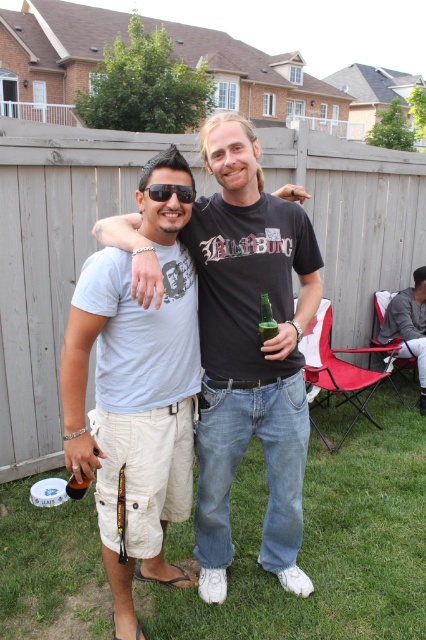
Looking at this image, can you confirm if light beige cargo shorts at center is thinner than green matte bottle at center?

In fact, light beige cargo shorts at center might be wider than green matte bottle at center.

Consider the image. Is light beige cargo shorts at center wider than green matte bottle at center?

Indeed, light beige cargo shorts at center has a greater width compared to green matte bottle at center.

You are a GUI agent. You are given a task and a screenshot of the screen. Output one action in this format:
    pyautogui.click(x=<x>, y=<y>)
    Task: Click on the light beige cargo shorts at center
    
    Given the screenshot: What is the action you would take?
    pyautogui.click(x=135, y=392)

Looking at this image, which is more to the left, matte black t-shirt at center or green matte bottle at center?

From the viewer's perspective, matte black t-shirt at center appears more on the left side.

Can you confirm if matte black t-shirt at center is positioned above green matte bottle at center?

No, matte black t-shirt at center is not above green matte bottle at center.

At what (x,y) coordinates should I click in order to perform the action: click on matte black t-shirt at center. Please return your answer as a coordinate pair (x, y). The height and width of the screenshot is (640, 426). Looking at the image, I should click on (250, 352).

The image size is (426, 640). Identify the location of matte black t-shirt at center. (250, 352).

Based on the photo, between light beige cargo shorts at center and black matte sunglasses at center, which one is positioned higher?

Positioned higher is black matte sunglasses at center.

Is light beige cargo shorts at center closer to the viewer compared to black matte sunglasses at center?

Yes, it is in front of black matte sunglasses at center.

Between point (114, 465) and point (152, 192), which one is positioned behind?

The point (114, 465) is behind.

Identify the location of light beige cargo shorts at center. This screenshot has width=426, height=640. (135, 392).